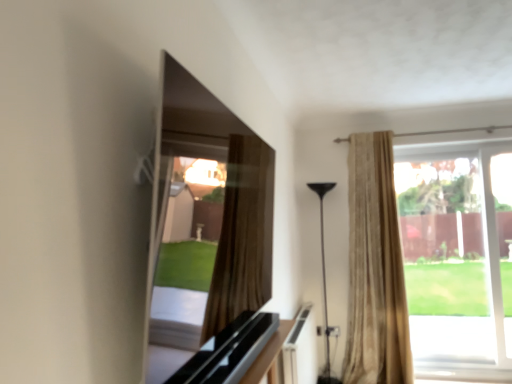
The width and height of the screenshot is (512, 384). What do you see at coordinates (375, 269) in the screenshot?
I see `beige textured curtain at right` at bounding box center [375, 269].

Locate an element on the screen. This screenshot has width=512, height=384. black glossy dresser at center is located at coordinates (239, 353).

The width and height of the screenshot is (512, 384). What are the coordinates of `smooth glass tv at upper center` in the screenshot? It's located at pyautogui.click(x=225, y=192).

Where is `lamp below the beige textured curtain at right (from the image's perspective)`? The image size is (512, 384). lamp below the beige textured curtain at right (from the image's perspective) is located at coordinates (324, 284).

Is point (321, 235) closer to viewer compared to point (399, 270)?

No, (321, 235) is further to viewer.

Is black glossy floor lamp at center looking in the opposite direction of beige textured curtain at right?

No.

Considering their positions, is black glossy floor lamp at center located in front of or behind beige textured curtain at right?

Visually, black glossy floor lamp at center is located behind beige textured curtain at right.

You are a GUI agent. You are given a task and a screenshot of the screen. Output one action in this format:
    pyautogui.click(x=<x>, y=<y>)
    Task: Click on the window on the right of black glossy dresser at center
    
    Given the screenshot: What is the action you would take?
    pyautogui.click(x=457, y=256)

How different are the orientations of black glossy dresser at center and clear glass window at right in degrees?

They differ by 90.2 degrees in their facing directions.

Is clear glass window at right surrounded by black glossy dresser at center?

Definitely not — clear glass window at right is not inside black glossy dresser at center.

Measure the distance from black glossy dresser at center to clear glass window at right.

black glossy dresser at center is 2.88 meters from clear glass window at right.

Is black glossy dresser at center taller or shorter than beige textured curtain at right?

Considering their sizes, black glossy dresser at center has less height than beige textured curtain at right.

Considering the sizes of black glossy dresser at center and beige textured curtain at right in the image, is black glossy dresser at center bigger or smaller than beige textured curtain at right?

Clearly, black glossy dresser at center is smaller in size than beige textured curtain at right.

Is black glossy dresser at center at the right side of beige textured curtain at right?

No, black glossy dresser at center is not to the right of beige textured curtain at right.

Does smooth glass tv at upper center contain black glossy floor lamp at center?

Definitely not — black glossy floor lamp at center is not inside smooth glass tv at upper center.

How far apart are smooth glass tv at upper center and black glossy floor lamp at center?

smooth glass tv at upper center and black glossy floor lamp at center are 8.33 feet apart.

Considering the positions of objects smooth glass tv at upper center and black glossy floor lamp at center in the image provided, who is more to the left, smooth glass tv at upper center or black glossy floor lamp at center?

From the viewer's perspective, smooth glass tv at upper center appears more on the left side.

Is point (255, 280) closer to viewer compared to point (326, 305)?

Yes, point (255, 280) is in front of point (326, 305).

Find the location of `window above the black glossy floor lamp at center (from a real-world perspective)`. window above the black glossy floor lamp at center (from a real-world perspective) is located at coordinates (457, 256).

Based on the photo, is clear glass window at right positioned far away from black glossy floor lamp at center?

Indeed, clear glass window at right is not near black glossy floor lamp at center.

From the image's perspective, is clear glass window at right under black glossy floor lamp at center?

Actually, clear glass window at right appears above black glossy floor lamp at center in the image.

Between beige textured curtain at right and smooth glass tv at upper center, which one has less height?

With less height is smooth glass tv at upper center.

Is beige textured curtain at right oriented towards smooth glass tv at upper center?

Yes, beige textured curtain at right faces towards smooth glass tv at upper center.

From the image's perspective, is beige textured curtain at right below smooth glass tv at upper center?

Correct, beige textured curtain at right appears lower than smooth glass tv at upper center in the image.

Is beige textured curtain at right thinner than smooth glass tv at upper center?

No.

Could you tell me if black glossy dresser at center is turned towards black glossy floor lamp at center?

No, black glossy dresser at center is not turned towards black glossy floor lamp at center.

How different are the orientations of black glossy dresser at center and black glossy floor lamp at center in degrees?

black glossy dresser at center and black glossy floor lamp at center are facing 91.9 degrees away from each other.

Would you say black glossy dresser at center is to the left or to the right of black glossy floor lamp at center in the picture?

black glossy dresser at center is to the left of black glossy floor lamp at center.

Where is `curtain above the black glossy floor lamp at center (from a real-world perspective)`? This screenshot has height=384, width=512. curtain above the black glossy floor lamp at center (from a real-world perspective) is located at coordinates (375, 269).

What are the coordinates of `window behind the black glossy dresser at center` in the screenshot? It's located at (457, 256).

Estimate the real-world distances between objects in this image. Which object is further from smooth glass tv at upper center, black glossy dresser at center or clear glass window at right?

clear glass window at right lies further to smooth glass tv at upper center than the other object.

Considering their positions, is clear glass window at right positioned further to black glossy floor lamp at center than smooth glass tv at upper center?

The object further to black glossy floor lamp at center is smooth glass tv at upper center.

When comparing their distances from smooth glass tv at upper center, does black glossy floor lamp at center or clear glass window at right seem closer?

black glossy floor lamp at center lies closer to smooth glass tv at upper center than the other object.

When comparing their distances from beige textured curtain at right, does black glossy floor lamp at center or smooth glass tv at upper center seem closer?

Among the two, black glossy floor lamp at center is located nearer to beige textured curtain at right.

Estimate the real-world distances between objects in this image. Which object is further from clear glass window at right, beige textured curtain at right or black glossy dresser at center?

black glossy dresser at center lies further to clear glass window at right than the other object.

Looking at the image, which one is located closer to black glossy dresser at center, black glossy floor lamp at center or clear glass window at right?

black glossy floor lamp at center is positioned closer to the anchor black glossy dresser at center.

Considering their positions, is black glossy floor lamp at center positioned closer to clear glass window at right than smooth glass tv at upper center?

Among the two, black glossy floor lamp at center is located nearer to clear glass window at right.

In the scene shown: Estimate the real-world distances between objects in this image. Which object is further from beige textured curtain at right, black glossy floor lamp at center or clear glass window at right?

Based on the image, clear glass window at right appears to be further to beige textured curtain at right.

Find the location of `curtain between black glossy dresser at center and black glossy floor lamp at center in the front-back direction`. curtain between black glossy dresser at center and black glossy floor lamp at center in the front-back direction is located at coordinates (375, 269).

Where is `curtain between smooth glass tv at upper center and black glossy floor lamp at center along the z-axis`? This screenshot has width=512, height=384. curtain between smooth glass tv at upper center and black glossy floor lamp at center along the z-axis is located at coordinates (375, 269).

This screenshot has width=512, height=384. Find the location of `curtain positioned between black glossy dresser at center and clear glass window at right from near to far`. curtain positioned between black glossy dresser at center and clear glass window at right from near to far is located at coordinates (375, 269).

Locate an element on the screen. The image size is (512, 384). lamp between black glossy dresser at center and clear glass window at right along the z-axis is located at coordinates (324, 284).